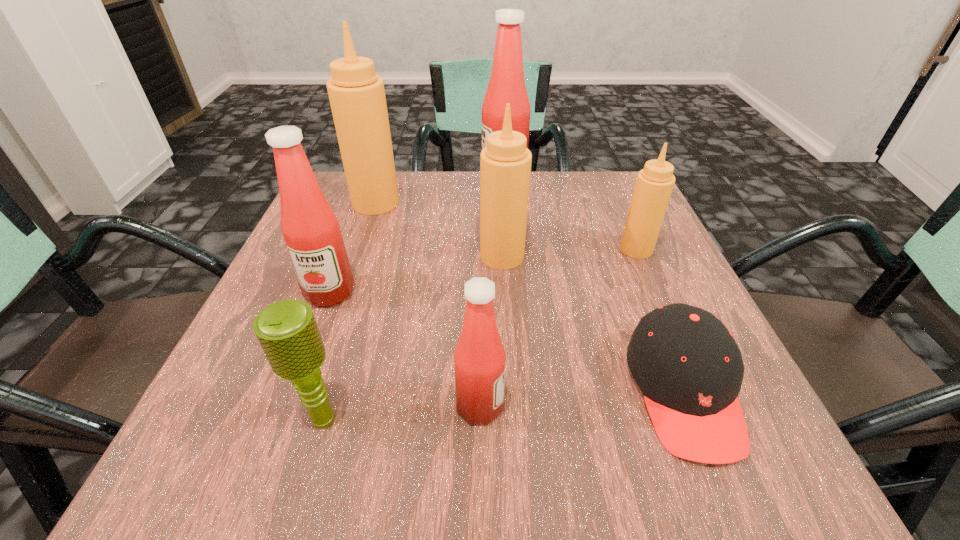
The width and height of the screenshot is (960, 540). Find the location of `vacant space situated 0.300m on the back of the microphone`. vacant space situated 0.300m on the back of the microphone is located at coordinates (370, 264).

At what (x,y) coordinates should I click in order to perform the action: click on condiment at the near edge. Please return your answer as a coordinate pair (x, y). This screenshot has height=540, width=960. Looking at the image, I should click on 479,359.

Find the location of a particular element. microphone located at the near edge is located at coordinates (287, 331).

Find the location of a particular element. This screenshot has width=960, height=540. cap present at the near edge is located at coordinates [x=687, y=364].

Locate an element on the screen. microphone present at the left edge is located at coordinates (287, 331).

What are the coordinates of `condiment present at the right edge` in the screenshot? It's located at (654, 184).

Where is `cap that is at the right edge`? cap that is at the right edge is located at coordinates (687, 364).

You are a GUI agent. You are given a task and a screenshot of the screen. Output one action in this format:
    pyautogui.click(x=<x>, y=<y>)
    Task: Click on the object at the far left corner
    
    Given the screenshot: What is the action you would take?
    coord(357,97)

Where is `object present at the near left corner`? This screenshot has width=960, height=540. object present at the near left corner is located at coordinates (287, 331).

This screenshot has height=540, width=960. Find the location of `object that is at the near right corner`. object that is at the near right corner is located at coordinates (687, 364).